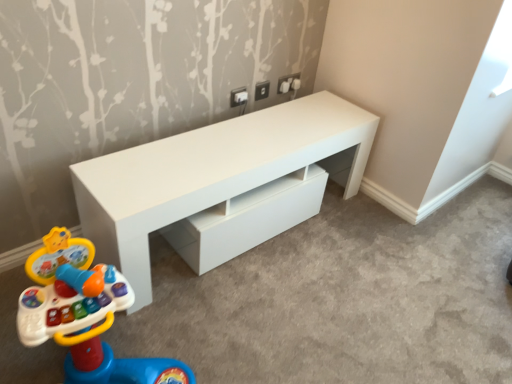
Locate an element on the screen. The width and height of the screenshot is (512, 384). free space above white glossy table at center (from a real-world perspective) is located at coordinates [x=241, y=140].